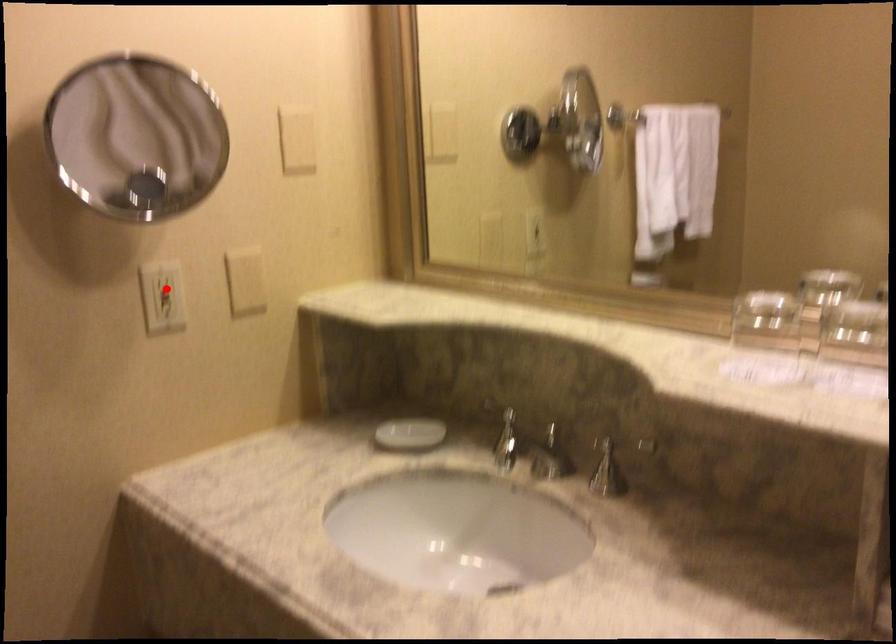
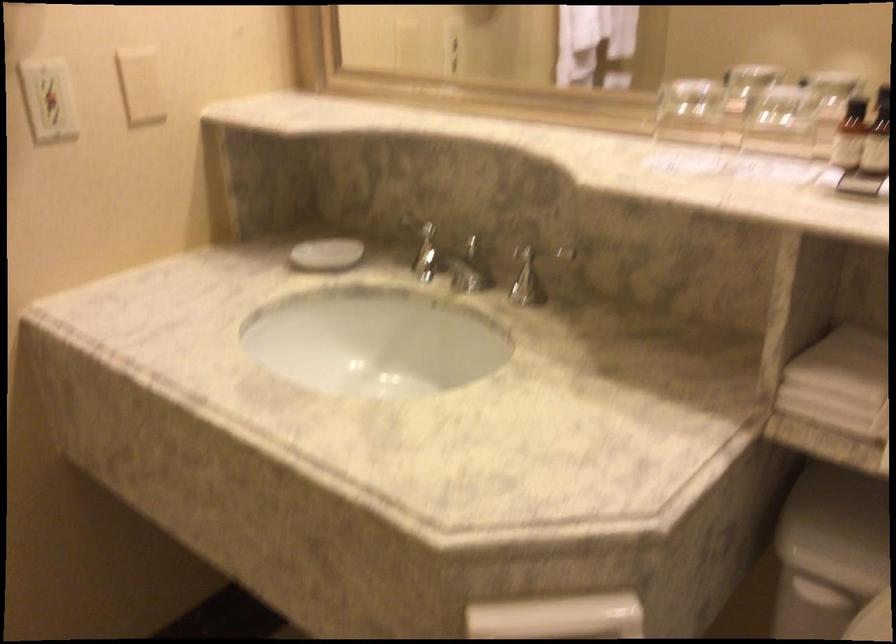
The point at the highlighted location is marked in the first image. Where is the corresponding point in the second image?

(47, 99)